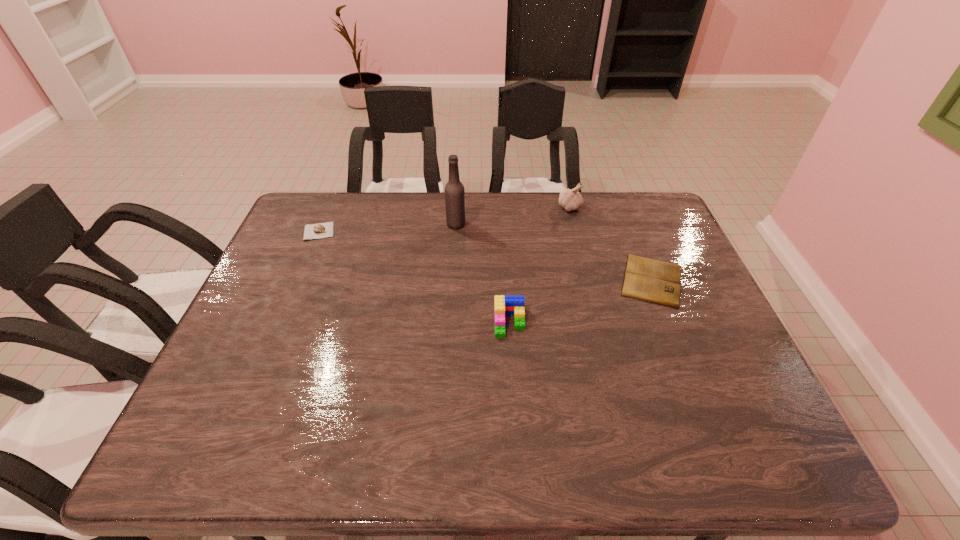
The image size is (960, 540). Find the location of `vacant space located on the label of the beer bottle`. vacant space located on the label of the beer bottle is located at coordinates (506, 224).

Where is `vacant space situated on the front of the taller garlic`? The height and width of the screenshot is (540, 960). vacant space situated on the front of the taller garlic is located at coordinates (580, 248).

You are a GUI agent. You are given a task and a screenshot of the screen. Output one action in this format:
    pyautogui.click(x=<x>, y=<y>)
    Task: Click on the vacant space located 0.310m on the right of the third shortest object
    
    Given the screenshot: What is the action you would take?
    pyautogui.click(x=646, y=322)

Find the location of a particular element. vacant region located on the right of the left garlic is located at coordinates (403, 231).

Identify the location of blank area located 0.230m on the back of the rightmost object. (623, 210).

The image size is (960, 540). Find the location of `beer bottle present at the far edge`. beer bottle present at the far edge is located at coordinates (454, 190).

Locate an element on the screen. The height and width of the screenshot is (540, 960). object at the left edge is located at coordinates (319, 230).

The width and height of the screenshot is (960, 540). Find the location of `object present at the right edge`. object present at the right edge is located at coordinates (654, 281).

You are a GUI agent. You are given a task and a screenshot of the screen. Output one action in this format:
    pyautogui.click(x=<x>, y=<y>)
    Task: Click on the object located at the far left corner
    Image resolution: width=960 pixels, height=540 pixels.
    Given the screenshot: What is the action you would take?
    coord(319,230)

The image size is (960, 540). In order to click on free space at the far edge in this screenshot , I will do `click(406, 209)`.